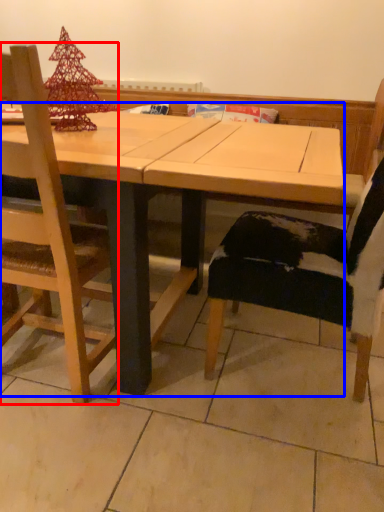
Question: Which object appears farthest to the camera in this image, chair (highlighted by a red box) or table (highlighted by a blue box)?

Choices:
 (A) chair
 (B) table

Answer: (B)